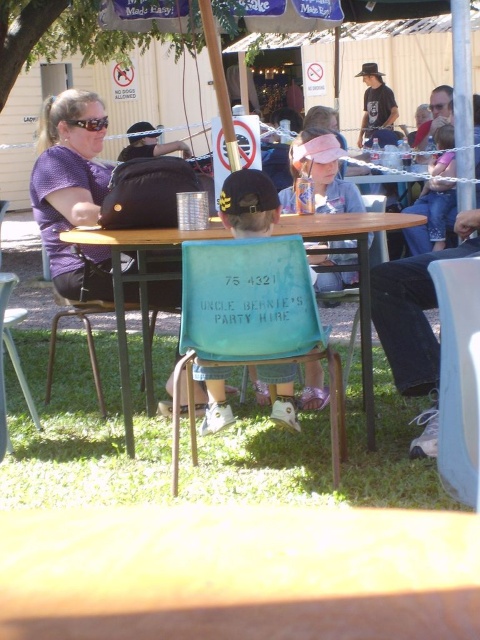
Is wooden table at center to the left of blue plastic chair at lower right from the viewer's perspective?

Indeed, wooden table at center is positioned on the left side of blue plastic chair at lower right.

Who is lower down, wooden table at center or blue plastic chair at lower right?

blue plastic chair at lower right

You are a GUI agent. You are given a task and a screenshot of the screen. Output one action in this format:
    pyautogui.click(x=<x>, y=<y>)
    Task: Click on the wooden table at center
    Image resolution: width=480 pixels, height=640 pixels.
    Given the screenshot: What is the action you would take?
    pyautogui.click(x=140, y=296)

Who is higher up, matte purple shirt at left or wooden table at center?

Positioned higher is matte purple shirt at left.

Is point (165, 285) positioned after point (369, 445)?

Yes, it is.

You are a GUI agent. You are given a task and a screenshot of the screen. Output one action in this format:
    pyautogui.click(x=<x>, y=<y>)
    Task: Click on the matte purple shirt at left
    The width and height of the screenshot is (480, 640).
    Given the screenshot: What is the action you would take?
    pyautogui.click(x=72, y=189)

How much distance is there between teal plastic chair at center and blue plastic chair at lower right?

teal plastic chair at center is 72.60 centimeters away from blue plastic chair at lower right.

Which is more to the right, teal plastic chair at center or blue plastic chair at lower right?

From the viewer's perspective, blue plastic chair at lower right appears more on the right side.

Identify the location of teal plastic chair at center. The image size is (480, 640). (255, 312).

The height and width of the screenshot is (640, 480). What are the coordinates of `teal plastic chair at center` in the screenshot? It's located at (255, 312).